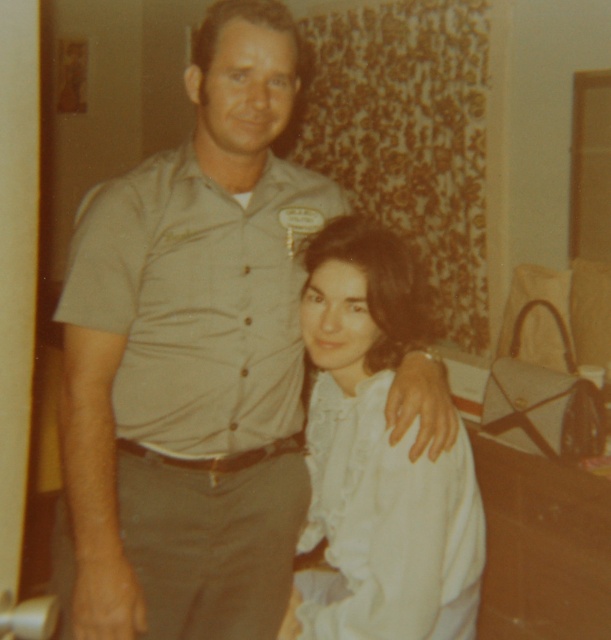
Is point (153, 212) in front of point (469, 540)?

That is True.

Describe the element at coordinates (191, 358) in the screenshot. The width and height of the screenshot is (611, 640). I see `matte khaki shirt at center` at that location.

Which is in front, point (240, 124) or point (338, 490)?

Point (240, 124) is more forward.

The width and height of the screenshot is (611, 640). I want to click on matte khaki shirt at center, so click(x=191, y=358).